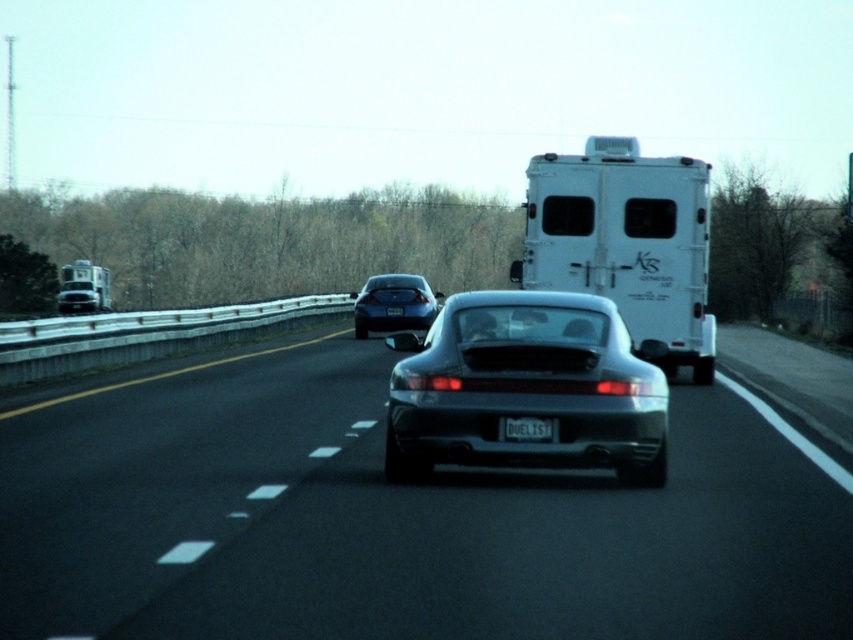
Is glossy metallic sedan at center positioned behind white plastic license plate at rear?

No, it is in front of white plastic license plate at rear.

Measure the distance between point (387, 330) and camera.

The distance of point (387, 330) from camera is 99.37 feet.

Does point (376, 282) come behind point (393, 314)?

Yes.

The image size is (853, 640). What are the coordinates of `glossy metallic sedan at center` in the screenshot? It's located at (393, 304).

Does glossy asphalt road at center have a smaller size compared to white matte horse trailer at left?

Yes.

Is glossy asphalt road at center positioned before white matte horse trailer at left?

That is True.

At what (x,y) coordinates should I click in order to perform the action: click on glossy asphalt road at center. Please return your answer as a coordinate pair (x, y). This screenshot has width=853, height=640. Looking at the image, I should click on (397, 518).

Can you confirm if satin black car at center is positioned to the left of white matte horse trailer at left?

No, satin black car at center is not to the left of white matte horse trailer at left.

Identify the location of satin black car at center. This screenshot has width=853, height=640. (525, 388).

Where is `satin black car at center`? The image size is (853, 640). satin black car at center is located at coordinates (525, 388).